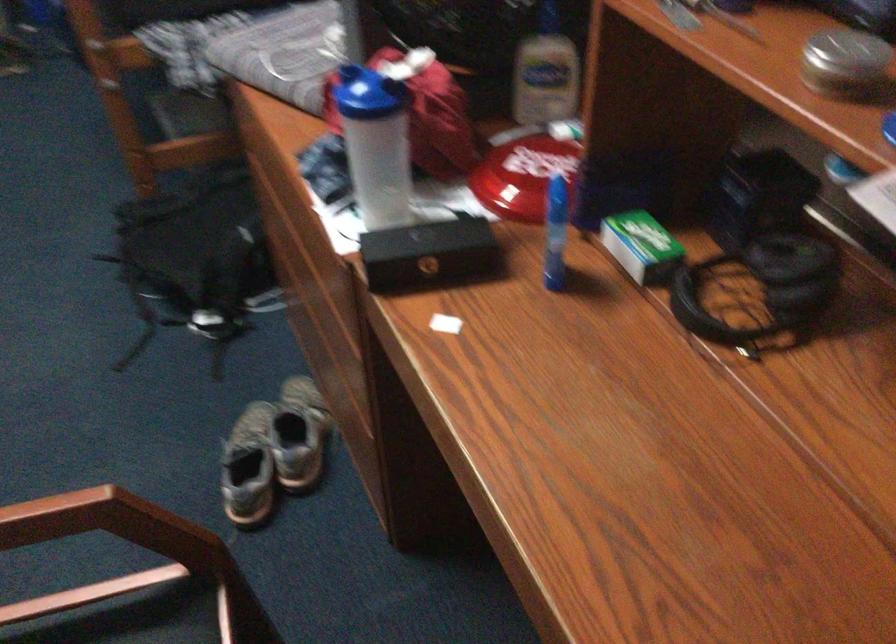
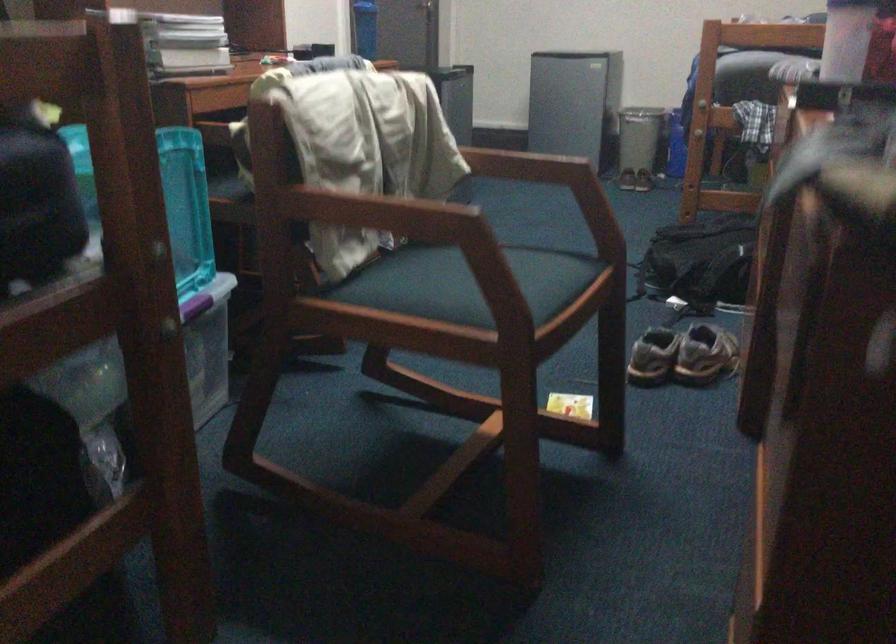
Find the pixel in the second image that matches the point at 280,469 in the first image.

(682, 355)